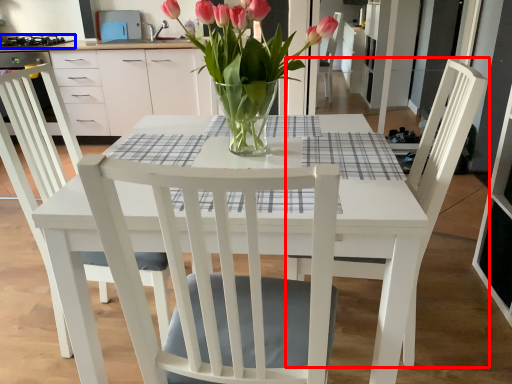
Question: Among these objects, which one is nearest to the camera, chair (highlighted by a red box) or appliance (highlighted by a blue box)?

Choices:
 (A) chair
 (B) appliance

Answer: (A)